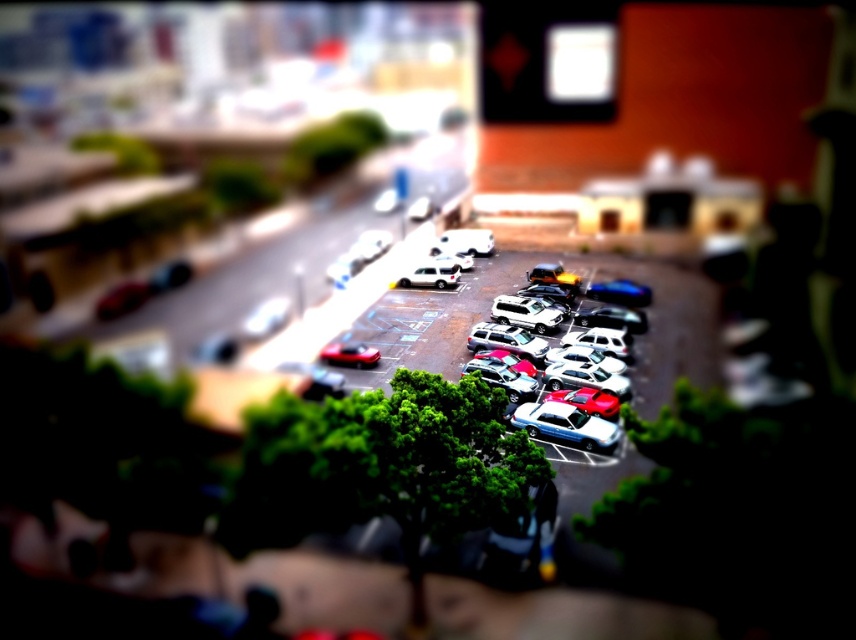
You are a toy car collector who wants to display both the shiny silver sedan at center and the satin silver suv at center on a shelf. If your shelf has a width of 1.2 meters, can both vehicles fit side by side without overlapping?

The shiny silver sedan at center is wider than the satin silver suv at center. However, since the exact widths are not provided, it is impossible to determine if both will fit within the 1.2 meters shelf width.

You are standing at the entrance of the parking lot and want to take a photo of the shiny metallic cars at center. Where should you position yourself to ensure they are in focus given the tilt shift effect?

To ensure the shiny metallic cars at center are in focus with the tilt shift effect, position yourself so that they are in the foreground of the image, as the tilt shift effect keeps the foreground sharply focused while blurring the background.